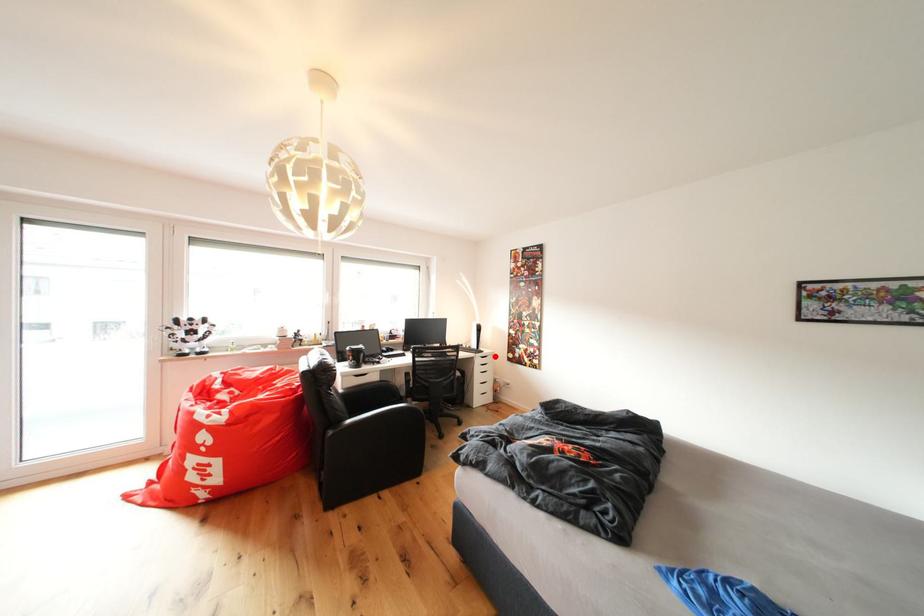
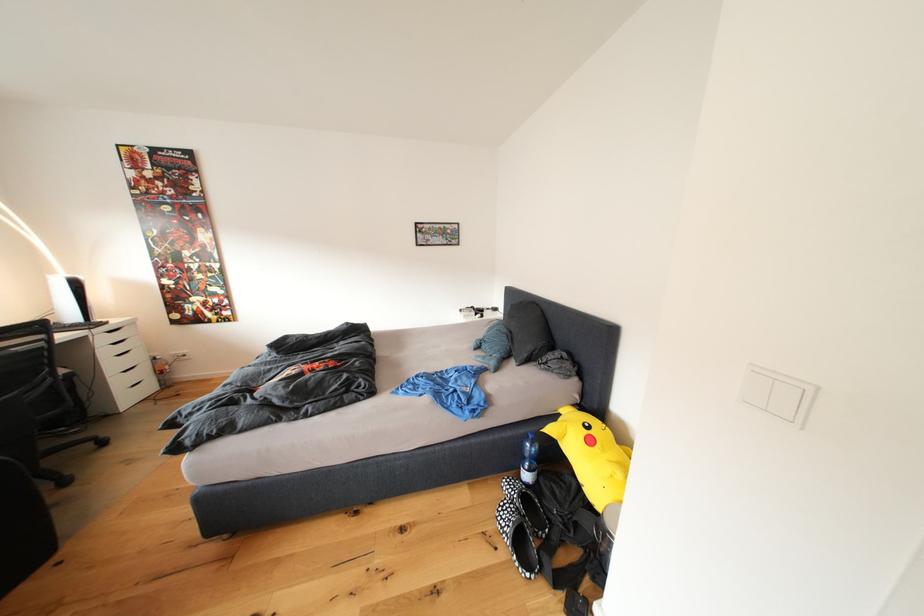
Where in the second image is the point corresponding to the highlighted location from the first image?

(125, 326)